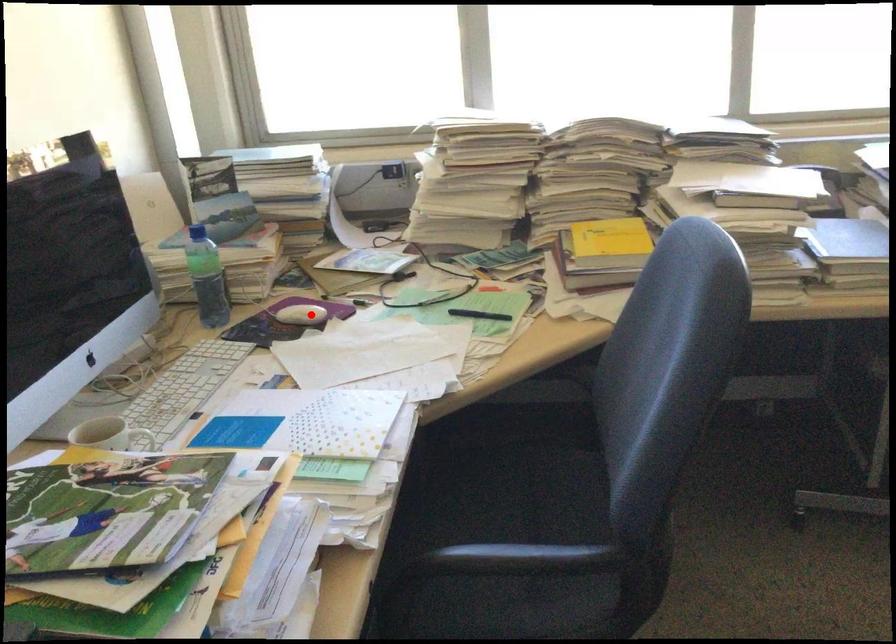
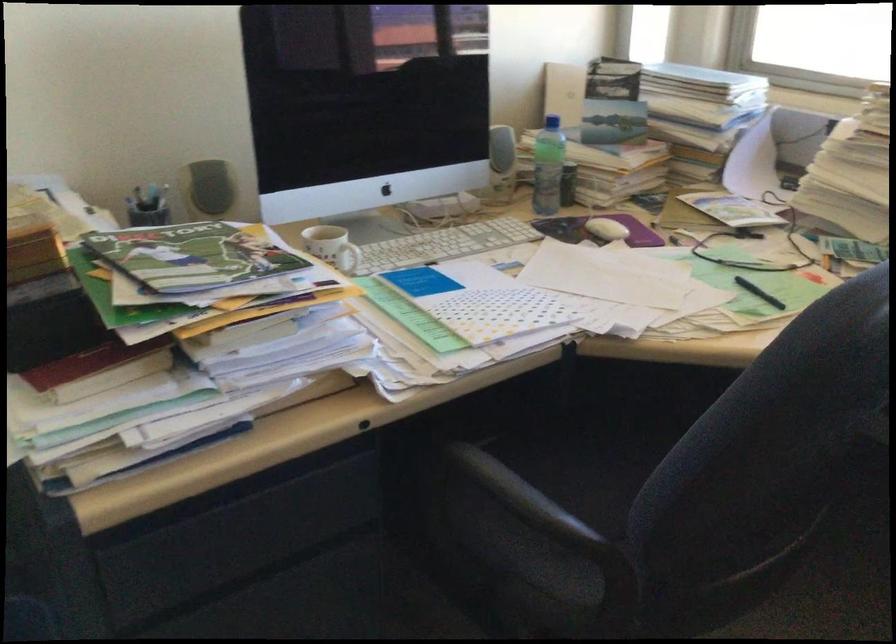
The point at the highlighted location is marked in the first image. Where is the corresponding point in the second image?

(606, 229)